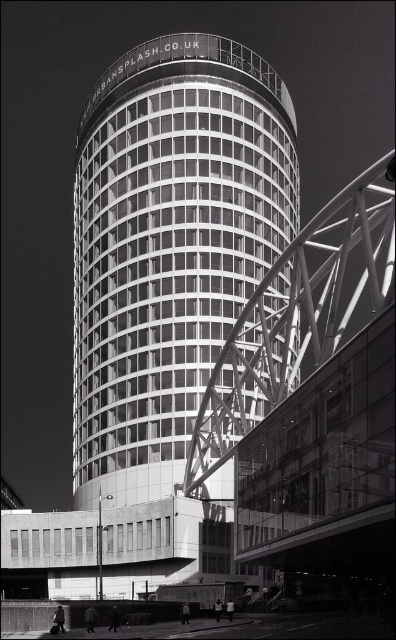
Between smooth glass tower at center and metallic gray bridge at center-right, which one is positioned lower?

Positioned lower is smooth glass tower at center.

This screenshot has width=396, height=640. In order to click on smooth glass tower at center in this screenshot , I will do `click(169, 246)`.